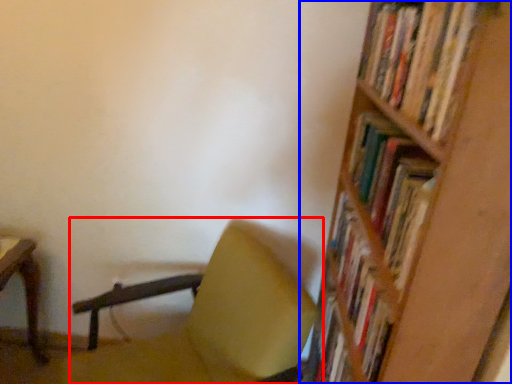
Question: Which point is closer to the camera, chair (highlighted by a red box) or shelf (highlighted by a blue box)?

Choices:
 (A) chair
 (B) shelf

Answer: (B)